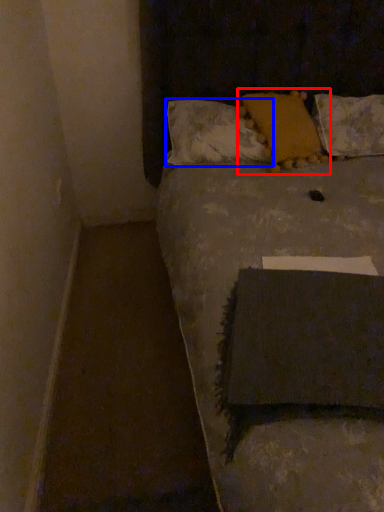
Question: Which of the following is the closest to the observer, pillow (highlighted by a red box) or pillow (highlighted by a blue box)?

Choices:
 (A) pillow
 (B) pillow

Answer: (A)